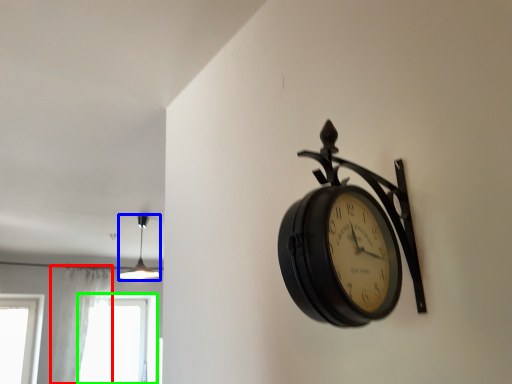
Question: Considering the real-world distances, which object is farthest from curtain (highlighted by a red box)? lamp (highlighted by a blue box) or window (highlighted by a green box)?

Choices:
 (A) lamp
 (B) window

Answer: (A)